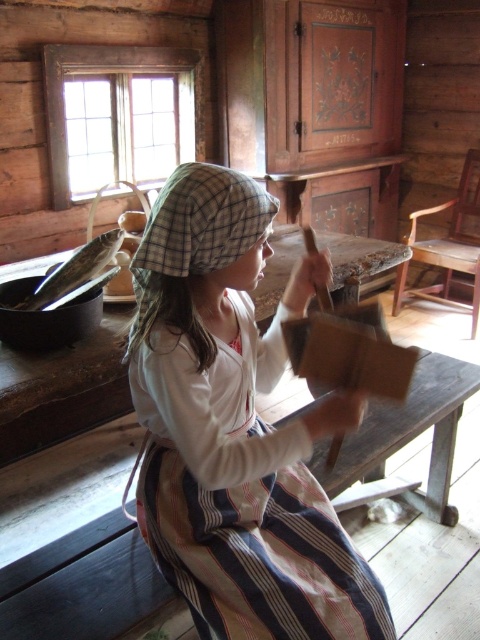
Question: Is striped cotton apron at center closer to camera compared to plaid fabric hat at center?

Choices:
 (A) no
 (B) yes

Answer: (A)

Question: Can you confirm if striped cotton apron at center is positioned below plaid fabric hat at center?

Choices:
 (A) yes
 (B) no

Answer: (A)

Question: Among these points, which one is nearest to the camera?

Choices:
 (A) (180, 296)
 (B) (240, 385)

Answer: (A)

Question: Is striped cotton apron at center wider than plaid fabric hat at center?

Choices:
 (A) yes
 (B) no

Answer: (A)